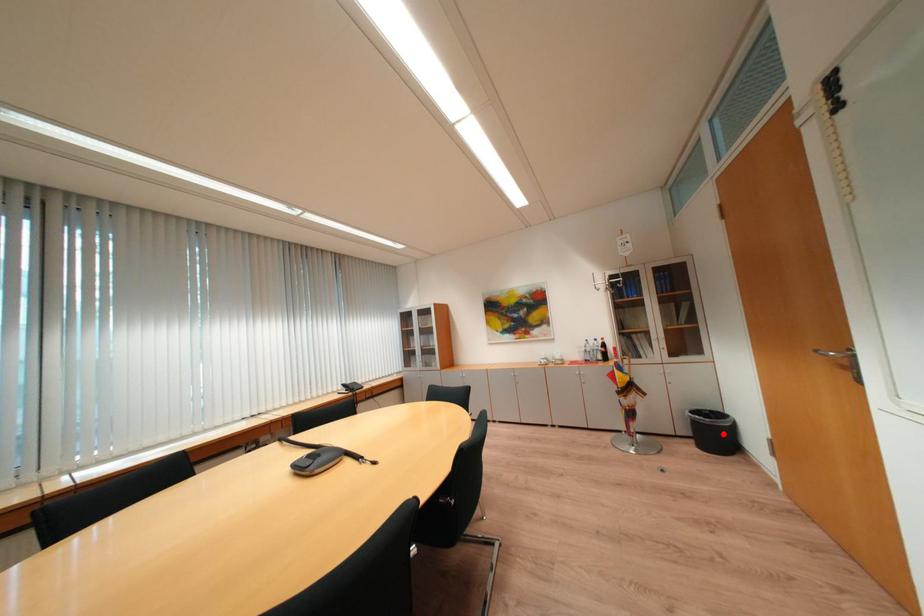
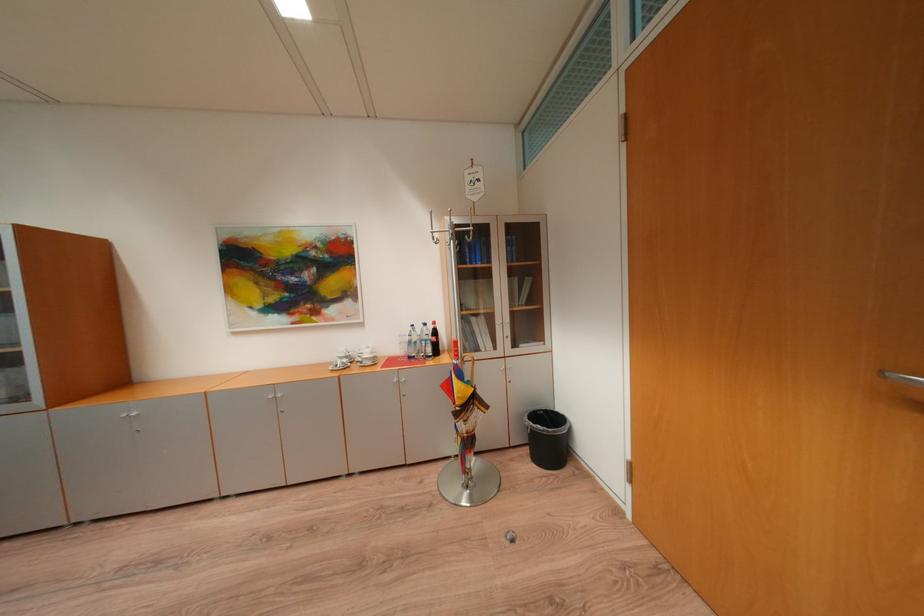
Find the pixel in the second image that matches the highlighted location in the first image.

(556, 440)